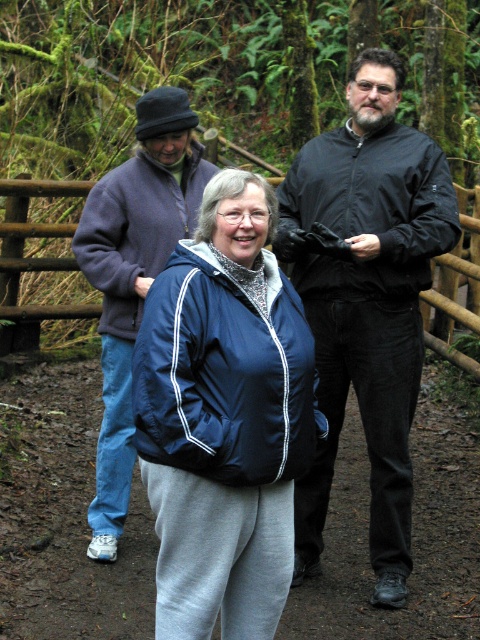
You are a photographer trying to capture a group photo of the black matte jacket at center and the blue fleece jacket at center. The camera you are using has a minimum focus distance of 30 inches. Will you be able to focus on both subjects simultaneously?

The black matte jacket at center and blue fleece jacket at center are 33.16 inches apart from each other. Since the distance between them is greater than the camera minimum focus distance of 30 inches, the camera can focus on both subjects simultaneously.

You are standing at the origin point of the coordinate system. Where is the navy blue jacket at center located in terms of coordinates?

The navy blue jacket at center is located at coordinates point (224, 417).

You are a photographer trying to capture a group photo of the two people in the center of the image wearing the black matte jacket at center and the blue fleece jacket at center. To ensure both are in the frame, should you adjust your camera to the left or the right?

The black matte jacket at center is to the right of the blue fleece jacket at center, so you should adjust your camera to the right to include both in the frame.